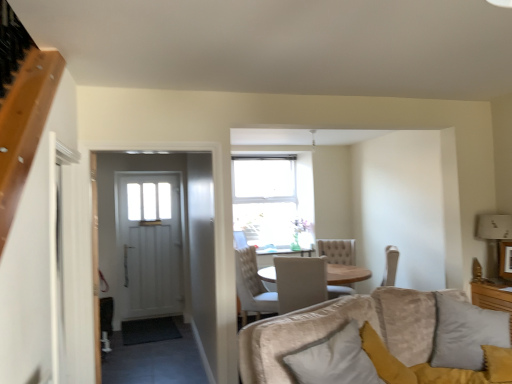
Question: Relative to white fabric lampshade at upper right, is velvet gray pillow at lower right, which ranks as the 2th pillow in left-to-right order, in front or behind?

Choices:
 (A) behind
 (B) front

Answer: (B)

Question: Considering the relative positions of velvet gray pillow at lower right, which ranks as the 2th pillow in left-to-right order, and white fabric lampshade at upper right in the image provided, is velvet gray pillow at lower right, which ranks as the 2th pillow in left-to-right order, to the left or to the right of white fabric lampshade at upper right?

Choices:
 (A) right
 (B) left

Answer: (B)

Question: Which is farther from the white soft pillow at lower right, marked as the 1th pillow in a left-to-right arrangement?

Choices:
 (A) white fabric lampshade at upper right
 (B) velvet gray pillow at lower right, which ranks as the 2th pillow in left-to-right order
 (C) beige fabric chair at center

Answer: (A)

Question: Considering the real-world distances, which object is farthest from the beige fabric chair at center?

Choices:
 (A) white fabric lampshade at upper right
 (B) white soft pillow at lower right, the second pillow positioned from the right
 (C) velvet gray pillow at lower right, which ranks as the first pillow in right-to-left order

Answer: (A)